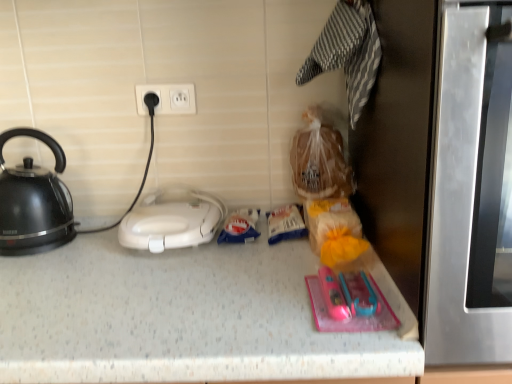
Question: Considering the positions of white plastic electric outlet at upper center and black glossy kettle at left in the image, is white plastic electric outlet at upper center taller or shorter than black glossy kettle at left?

Choices:
 (A) short
 (B) tall

Answer: (A)

Question: Considering the relative positions of white plastic electric outlet at upper center and black glossy kettle at left in the image provided, is white plastic electric outlet at upper center to the left or to the right of black glossy kettle at left?

Choices:
 (A) left
 (B) right

Answer: (B)

Question: Which object is the farthest from the stainless steel oven at right?

Choices:
 (A) white plastic toaster at center
 (B) white plastic electric outlet at upper center
 (C) black glossy kettle at left

Answer: (C)

Question: Which object is the farthest from the stainless steel oven at right?

Choices:
 (A) black glossy kettle at left
 (B) white plastic electric outlet at upper center
 (C) white plastic toaster at center

Answer: (A)